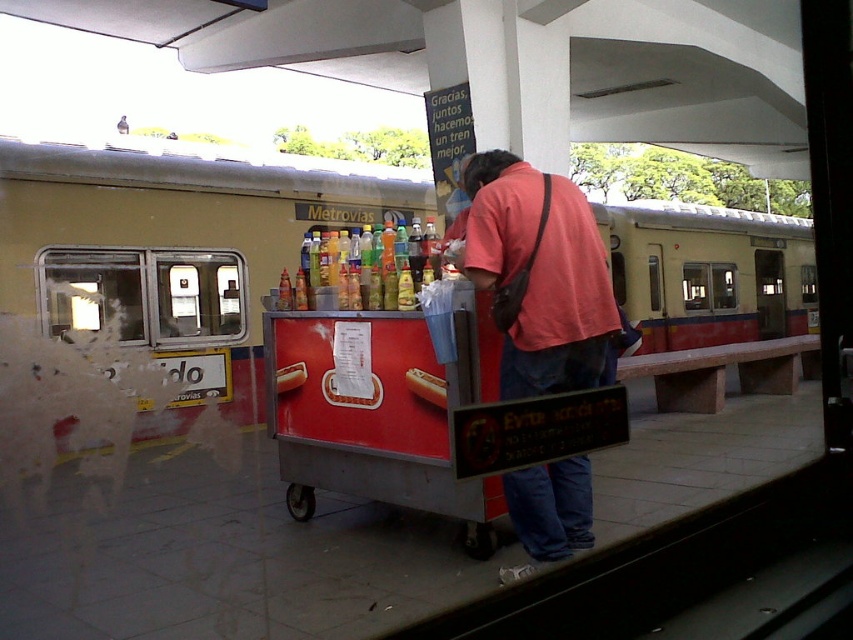
You are standing at the train station platform and want to take a photo of the food cart. There are two points marked on the cart where you can place your tripod. The first point is at coordinates point (466,268) and the second point is at point (408,388). Which point is closer to you so that you can adjust the camera angle easily?

Point (466,268) is closer to the viewer than point (408,388), so you should choose that point to adjust the camera angle easily.